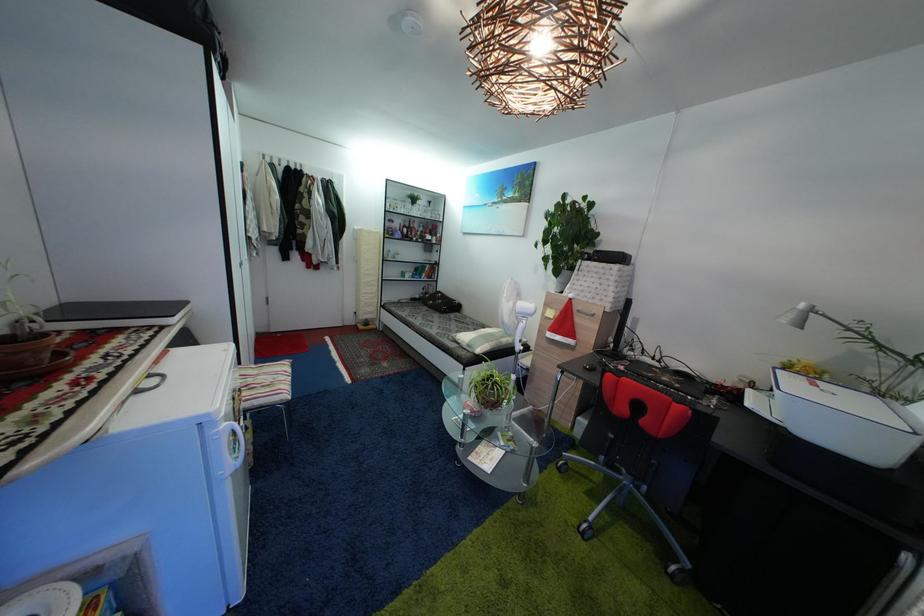
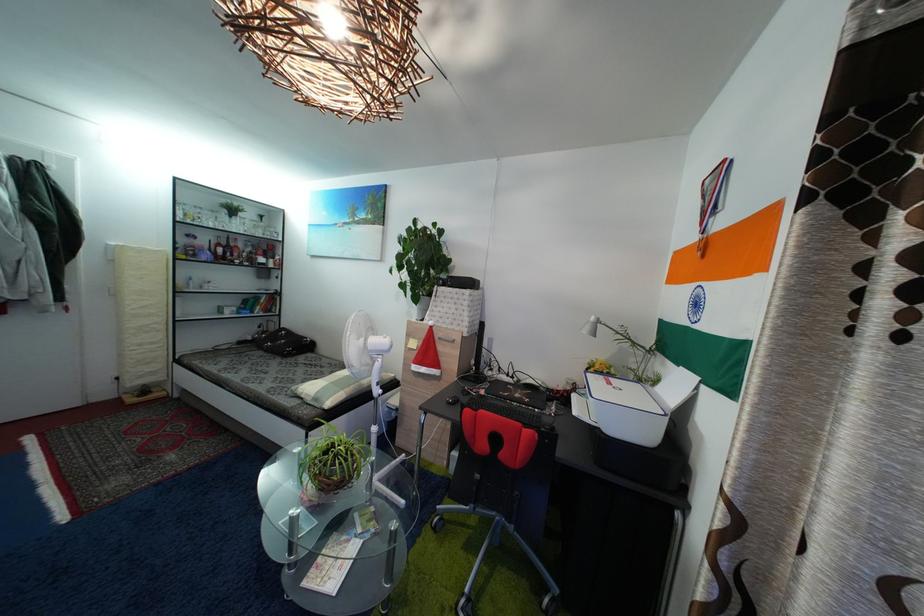
Find the pixel in the second image that matches [406,230] in the first image.

(213, 246)